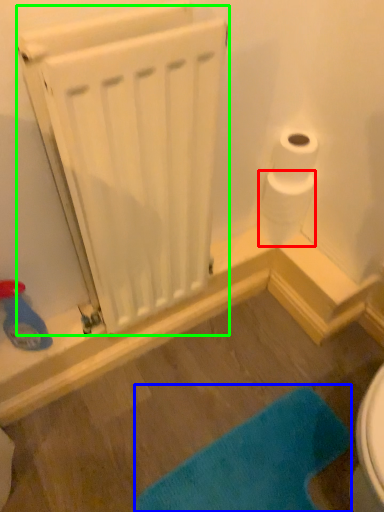
Question: Which object is positioned farthest from toilet paper (highlighted by a red box)? Select from bath mat (highlighted by a blue box) and radiator (highlighted by a green box).

Choices:
 (A) bath mat
 (B) radiator

Answer: (A)